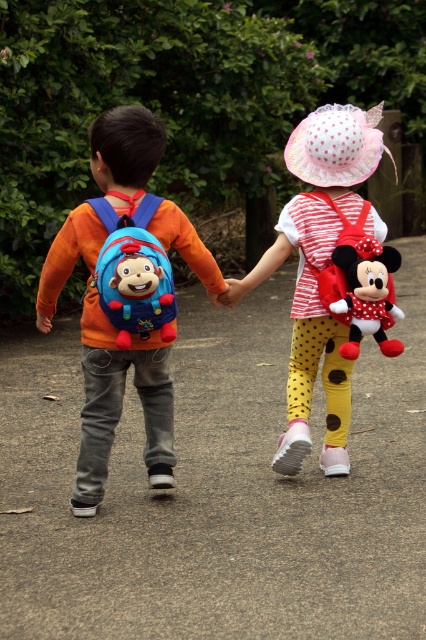
Is matte blue backpack at left closer to the viewer compared to polka dot fabric dress at center?

That is True.

Is point (126, 369) closer to viewer compared to point (339, 145)?

That is True.

Who is more distant from viewer, (132, 160) or (319, 211)?

The point (319, 211) is behind.

What are the coordinates of `matte blue backpack at left` in the screenshot? It's located at point(108,368).

Between matte blue backpack at left and matte blue fabric backpack at left, which one has more height?

matte blue backpack at left

Does point (89, 300) come behind point (131, 268)?

Yes, it is behind point (131, 268).

Where is `matte blue backpack at left`? The image size is (426, 640). matte blue backpack at left is located at coordinates (108, 368).

Is polka dot fabric dress at center shorter than red plush minnie mouse at back?

No, polka dot fabric dress at center is not shorter than red plush minnie mouse at back.

Which is more to the right, polka dot fabric dress at center or red plush minnie mouse at back?

Positioned to the right is red plush minnie mouse at back.

Does point (293, 429) come farther from viewer compared to point (373, 260)?

Yes, point (293, 429) is behind point (373, 260).

The image size is (426, 640). Find the location of `polka dot fabric dress at center`. polka dot fabric dress at center is located at coordinates (307, 333).